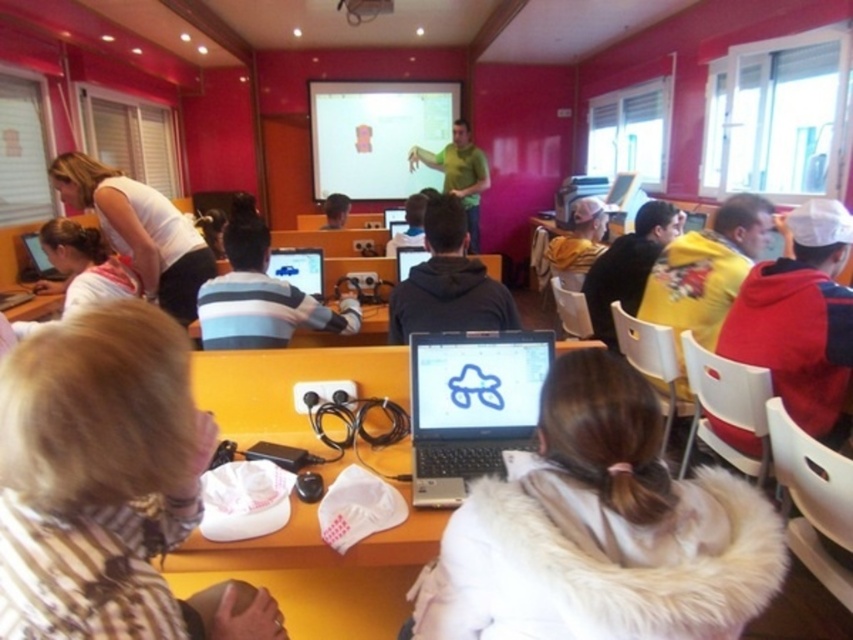
Does white fabric at center have a greater height compared to yellow matte shirt at right?

Incorrect, white fabric at center's height is not larger of yellow matte shirt at right's.

Measure the distance between white fabric at center and yellow matte shirt at right.

white fabric at center is 1.90 meters from yellow matte shirt at right.

The image size is (853, 640). What are the coordinates of `white fabric at center` in the screenshot? It's located at (96, 474).

Does white fur coat at center have a larger size compared to white fabric at left?

Yes.

Does white fur coat at center appear on the left side of white fabric at left?

No, white fur coat at center is not to the left of white fabric at left.

This screenshot has width=853, height=640. What are the coordinates of `white fur coat at center` in the screenshot? It's located at (601, 531).

Does matte black laptop at center appear over black glossy laptop at center?

No, matte black laptop at center is not above black glossy laptop at center.

Which of these two, matte black laptop at center or black glossy laptop at center, stands shorter?

Standing shorter between the two is black glossy laptop at center.

Where is `matte black laptop at center`? matte black laptop at center is located at coordinates (299, 268).